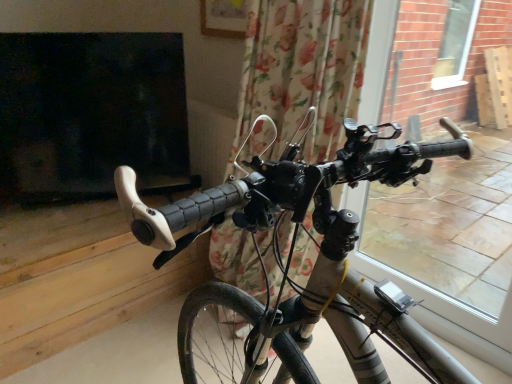
Question: Considering the relative positions of matte black handlebars at center and floral fabric curtain at center in the image provided, is matte black handlebars at center to the left of floral fabric curtain at center from the viewer's perspective?

Choices:
 (A) yes
 (B) no

Answer: (A)

Question: Could you tell me if matte black handlebars at center is turned towards floral fabric curtain at center?

Choices:
 (A) yes
 (B) no

Answer: (B)

Question: Considering the relative positions of matte black handlebars at center and floral fabric curtain at center in the image provided, is matte black handlebars at center to the right of floral fabric curtain at center from the viewer's perspective?

Choices:
 (A) yes
 (B) no

Answer: (B)

Question: Is matte black handlebars at center smaller than floral fabric curtain at center?

Choices:
 (A) no
 (B) yes

Answer: (A)

Question: Is matte black handlebars at center completely or partially outside of floral fabric curtain at center?

Choices:
 (A) no
 (B) yes

Answer: (B)

Question: From the image's perspective, is matte black handlebars at center over floral fabric curtain at center?

Choices:
 (A) no
 (B) yes

Answer: (A)

Question: From the image's perspective, is transparent glass window at right located above floral fabric curtain at center?

Choices:
 (A) yes
 (B) no

Answer: (B)

Question: Is the position of transparent glass window at right less distant than that of floral fabric curtain at center?

Choices:
 (A) no
 (B) yes

Answer: (A)

Question: Considering the relative sizes of transparent glass window at right and floral fabric curtain at center in the image provided, is transparent glass window at right thinner than floral fabric curtain at center?

Choices:
 (A) no
 (B) yes

Answer: (B)

Question: Is floral fabric curtain at center inside transparent glass window at right?

Choices:
 (A) yes
 (B) no

Answer: (B)

Question: Does transparent glass window at right have a larger size compared to floral fabric curtain at center?

Choices:
 (A) yes
 (B) no

Answer: (B)

Question: From a real-world perspective, is transparent glass window at right over floral fabric curtain at center?

Choices:
 (A) no
 (B) yes

Answer: (A)

Question: Is the depth of matte black handlebars at center less than that of transparent glass window at right?

Choices:
 (A) yes
 (B) no

Answer: (A)